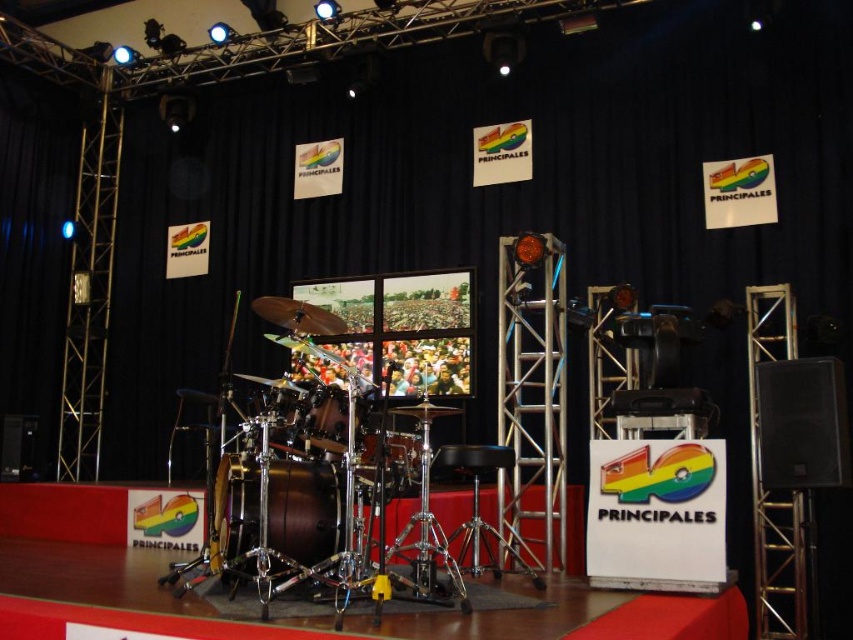
Which is below, mahogany polished wood drum at center or shiny brown drum at center?

Positioned lower is mahogany polished wood drum at center.

Between mahogany polished wood drum at center and shiny brown drum at center, which one is positioned higher?

shiny brown drum at center is above.

Does point (299, 474) come behind point (318, 390)?

Yes, it is behind point (318, 390).

Find the location of a particular element. Image resolution: width=853 pixels, height=640 pixels. mahogany polished wood drum at center is located at coordinates (276, 513).

Who is more forward, (248, 484) or (402, 468)?

Point (402, 468) is more forward.

The height and width of the screenshot is (640, 853). I want to click on mahogany polished wood drum at center, so click(x=276, y=513).

Find the location of `mahogany polished wood drum at center`. mahogany polished wood drum at center is located at coordinates (276, 513).

Who is shorter, shiny gold drum at center or shiny brown drum at center?

Standing shorter between the two is shiny brown drum at center.

Measure the distance between shiny gold drum at center and camera.

shiny gold drum at center is 3.21 meters away from camera.

Between point (363, 442) and point (341, 451), which one is positioned behind?

Point (363, 442)

The height and width of the screenshot is (640, 853). I want to click on shiny gold drum at center, so coord(392,460).